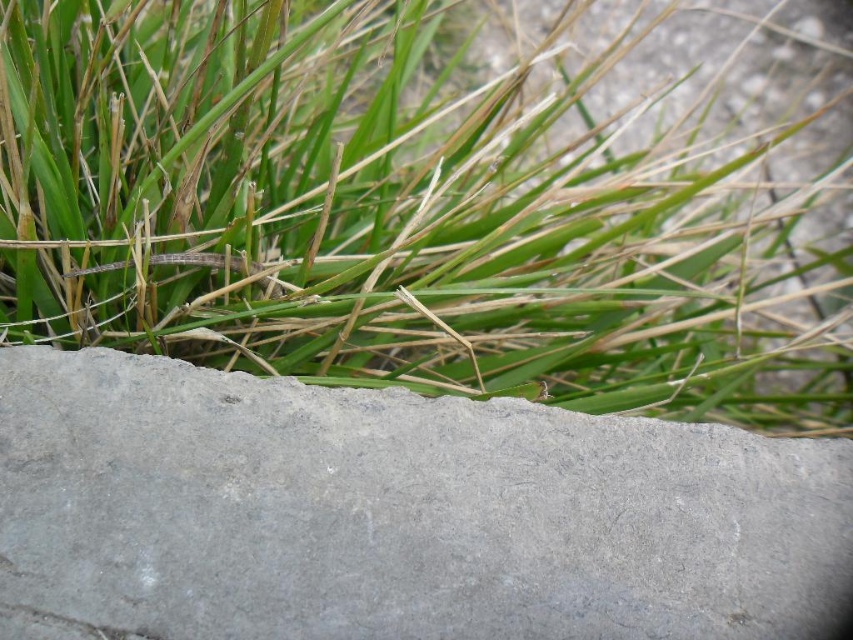
Looking at this image, you are a small robot with a camera. You want to take a photo of the gray concrete at bottom without the green grass at upper center blocking the view. Can you move forward or backward to achieve this?

The gray concrete at bottom is behind the green grass at upper center, so moving forward would bring the gray concrete at bottom closer and the green grass at upper center farther away. Moving backward would increase the distance between the robot and both objects, but the relative positions remain the same. To ensure the gray concrete at bottom is not blocked by the green grass at upper center, moving forward slightly would position the gray concrete at bottom in the foreground, potentially allowing it to

You are standing in a natural area and see the green grass at upper center and the gray concrete at bottom. Which object is located to the right of the other?

The green grass at upper center is positioned on the right side of gray concrete at bottom.

You are a gardener who wants to plant flowers in the green grass at upper center and the gray concrete at bottom. Which area requires more soil preparation because of its size?

The green grass at upper center requires more soil preparation because it is larger in size than the gray concrete at bottom, so it needs more work to prepare the soil appropriately.